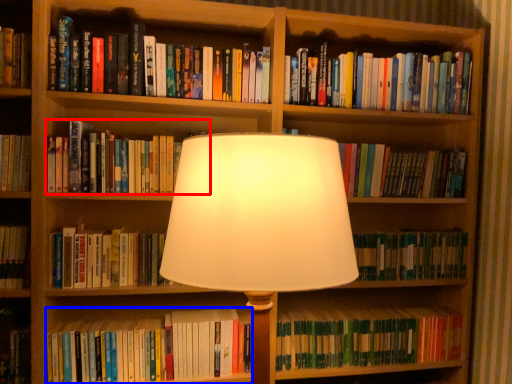
Question: Which of the following is the closest to the observer, book (highlighted by a red box) or book (highlighted by a blue box)?

Choices:
 (A) book
 (B) book

Answer: (A)